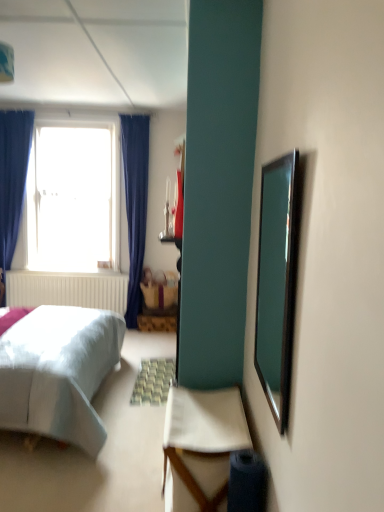
Question: From the image's perspective, would you say transparent glass window at upper left is positioned over clear glass mirror at right?

Choices:
 (A) no
 (B) yes

Answer: (B)

Question: Is transparent glass window at upper left beside clear glass mirror at right?

Choices:
 (A) no
 (B) yes

Answer: (A)

Question: Considering the relative sizes of transparent glass window at upper left and clear glass mirror at right in the image provided, is transparent glass window at upper left smaller than clear glass mirror at right?

Choices:
 (A) no
 (B) yes

Answer: (A)

Question: Does transparent glass window at upper left come in front of clear glass mirror at right?

Choices:
 (A) no
 (B) yes

Answer: (A)

Question: Is transparent glass window at upper left outside clear glass mirror at right?

Choices:
 (A) no
 (B) yes

Answer: (B)

Question: Is white fabric chair at lower center inside the boundaries of transparent glass window at upper left, or outside?

Choices:
 (A) inside
 (B) outside

Answer: (B)

Question: From a real-world perspective, is white fabric chair at lower center physically located above or below transparent glass window at upper left?

Choices:
 (A) below
 (B) above

Answer: (A)

Question: Is white fabric chair at lower center bigger or smaller than transparent glass window at upper left?

Choices:
 (A) small
 (B) big

Answer: (A)

Question: Would you say white fabric chair at lower center is to the left or to the right of transparent glass window at upper left in the picture?

Choices:
 (A) left
 (B) right

Answer: (B)

Question: Is point (105, 145) positioned closer to the camera than point (284, 286)?

Choices:
 (A) farther
 (B) closer

Answer: (A)

Question: Choose the correct answer: Is transparent glass window at upper left inside clear glass mirror at right or outside it?

Choices:
 (A) outside
 (B) inside

Answer: (A)

Question: From their relative heights in the image, would you say transparent glass window at upper left is taller or shorter than clear glass mirror at right?

Choices:
 (A) short
 (B) tall

Answer: (B)

Question: Would you say transparent glass window at upper left is to the left or to the right of clear glass mirror at right in the picture?

Choices:
 (A) left
 (B) right

Answer: (A)

Question: Looking at the image, does white fabric chair at lower center seem bigger or smaller compared to clear glass mirror at right?

Choices:
 (A) big
 (B) small

Answer: (A)

Question: Considering the positions of white fabric chair at lower center and clear glass mirror at right in the image, is white fabric chair at lower center wider or thinner than clear glass mirror at right?

Choices:
 (A) wide
 (B) thin

Answer: (A)